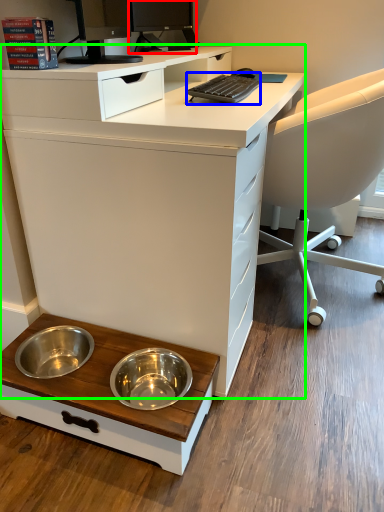
Question: Which object is the farthest from desktop computer (highlighted by a red box)? Choose among these: computer keyboard (highlighted by a blue box) or desk (highlighted by a green box).

Choices:
 (A) computer keyboard
 (B) desk

Answer: (B)